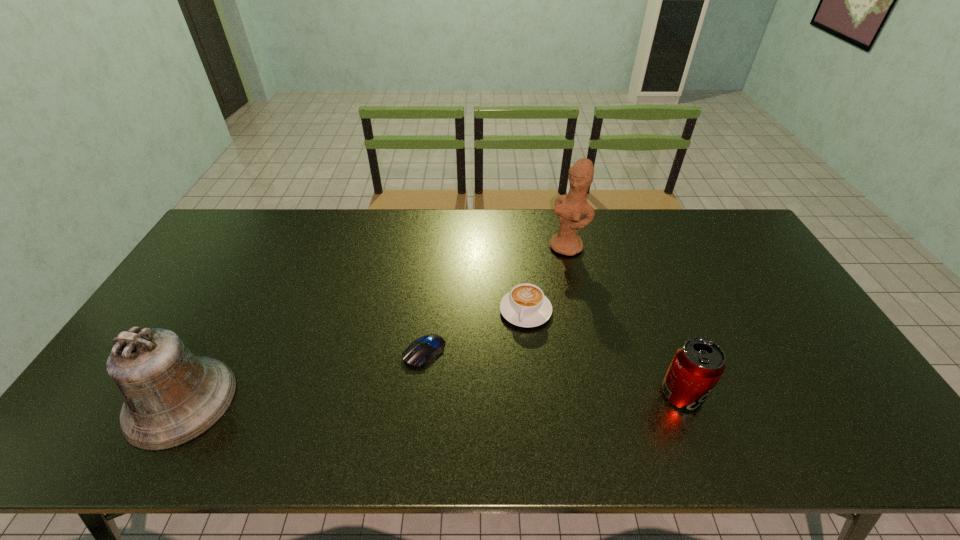
Choose which object is the second nearest neighbor to the bell. Please provide its 2D coordinates. Your answer should be formatted as a tuple, i.e. [(x, y)], where the tuple contains the x and y coordinates of a point satisfying the conditions above.

[(526, 305)]

At what (x,y) coordinates should I click in order to perform the action: click on the second closest object to the third shortest object. Please return your answer as a coordinate pair (x, y). Looking at the image, I should click on (570, 208).

Find the location of `free space that satisfies the following two spatial constraints: 1. on the front side of the tallest object; 2. on the right side of the rightmost object`. free space that satisfies the following two spatial constraints: 1. on the front side of the tallest object; 2. on the right side of the rightmost object is located at coordinates (600, 394).

Where is `vacant region that satisfies the following two spatial constraints: 1. on the back side of the shortest object; 2. on the right side of the bell`? This screenshot has height=540, width=960. vacant region that satisfies the following two spatial constraints: 1. on the back side of the shortest object; 2. on the right side of the bell is located at coordinates (208, 352).

This screenshot has width=960, height=540. What are the coordinates of `vacant space that satisfies the following two spatial constraints: 1. on the back side of the soda can; 2. on the right side of the fourth shortest object` in the screenshot? It's located at (185, 394).

This screenshot has width=960, height=540. I want to click on blank space that satisfies the following two spatial constraints: 1. on the back side of the cappuccino; 2. on the left side of the shortest object, so click(x=429, y=310).